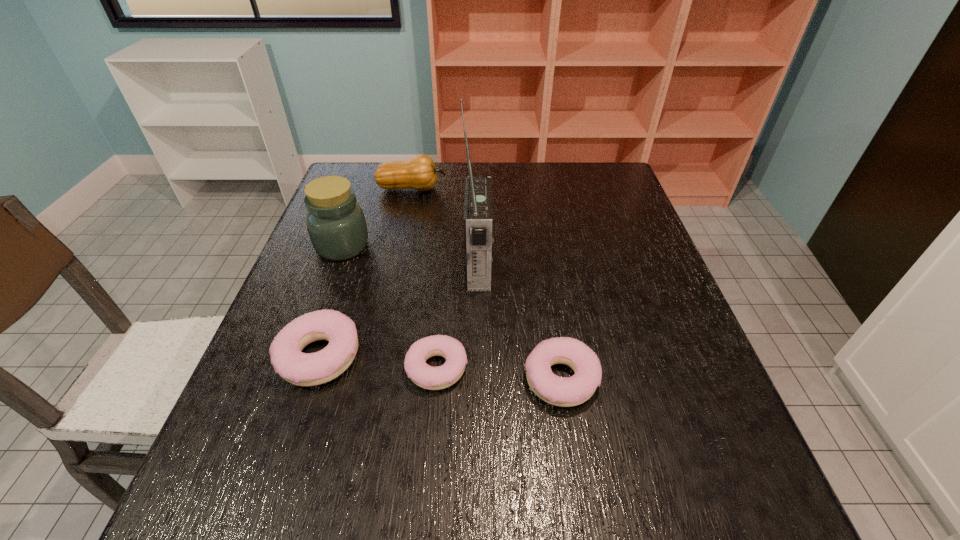
I want to click on free point located on the front of the shortest doughnut, so click(431, 440).

Where is `free location located on the left of the rightmost object`? free location located on the left of the rightmost object is located at coordinates (452, 380).

Where is `free space located on the front of the fifth shortest object`? This screenshot has height=540, width=960. free space located on the front of the fifth shortest object is located at coordinates (322, 304).

You are a GUI agent. You are given a task and a screenshot of the screen. Output one action in this format:
    pyautogui.click(x=<x>, y=<y>)
    Task: Click on the blank area located on the stem side of the gourd
    
    Given the screenshot: What is the action you would take?
    pyautogui.click(x=549, y=188)

Identify the location of free point located on the display of the tallest object. (564, 266).

Find the location of a particular element. object situated at the far edge is located at coordinates (419, 172).

Identify the location of object at the near edge. This screenshot has height=540, width=960. (560, 391).

The height and width of the screenshot is (540, 960). What are the coordinates of `doughnut located in the left edge section of the desktop` in the screenshot? It's located at (302, 369).

I want to click on jar present at the left edge, so click(x=336, y=224).

At what (x,y) coordinates should I click in order to perform the action: click on gourd located in the left edge section of the desktop. Please return your answer as a coordinate pair (x, y). Looking at the image, I should click on (419, 172).